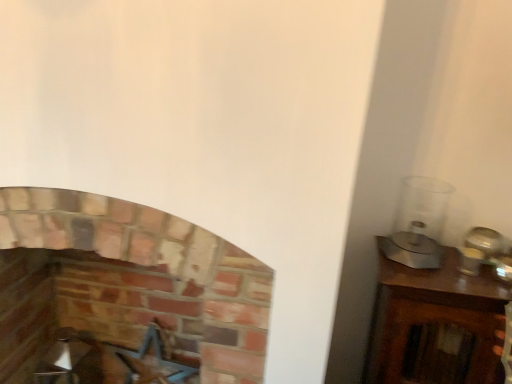
Question: From a real-world perspective, is metallic blue swivel chair at lower left located higher than brick fireplace at center?

Choices:
 (A) yes
 (B) no

Answer: (B)

Question: Can you confirm if metallic blue swivel chair at lower left is wider than brick fireplace at center?

Choices:
 (A) yes
 (B) no

Answer: (B)

Question: Is metallic blue swivel chair at lower left far away from brick fireplace at center?

Choices:
 (A) no
 (B) yes

Answer: (A)

Question: Does metallic blue swivel chair at lower left have a smaller size compared to brick fireplace at center?

Choices:
 (A) no
 (B) yes

Answer: (B)

Question: Does metallic blue swivel chair at lower left have a lesser height compared to brick fireplace at center?

Choices:
 (A) no
 (B) yes

Answer: (B)

Question: From the image's perspective, is metallic blue swivel chair at lower left below brick fireplace at center?

Choices:
 (A) no
 (B) yes

Answer: (B)

Question: Is brick fireplace at center oriented towards metallic blue swivel chair at lower left?

Choices:
 (A) yes
 (B) no

Answer: (A)

Question: From the image's perspective, does brick fireplace at center appear lower than metallic blue swivel chair at lower left?

Choices:
 (A) yes
 (B) no

Answer: (B)

Question: Is brick fireplace at center positioned in front of metallic blue swivel chair at lower left?

Choices:
 (A) no
 (B) yes

Answer: (B)

Question: Does brick fireplace at center have a lesser width compared to metallic blue swivel chair at lower left?

Choices:
 (A) yes
 (B) no

Answer: (B)

Question: Is brick fireplace at center looking in the opposite direction of metallic blue swivel chair at lower left?

Choices:
 (A) no
 (B) yes

Answer: (B)

Question: From a real-world perspective, is brick fireplace at center located higher than metallic blue swivel chair at lower left?

Choices:
 (A) yes
 (B) no

Answer: (A)

Question: In terms of height, does metallic blue swivel chair at lower left look taller or shorter compared to brick fireplace at center?

Choices:
 (A) short
 (B) tall

Answer: (A)